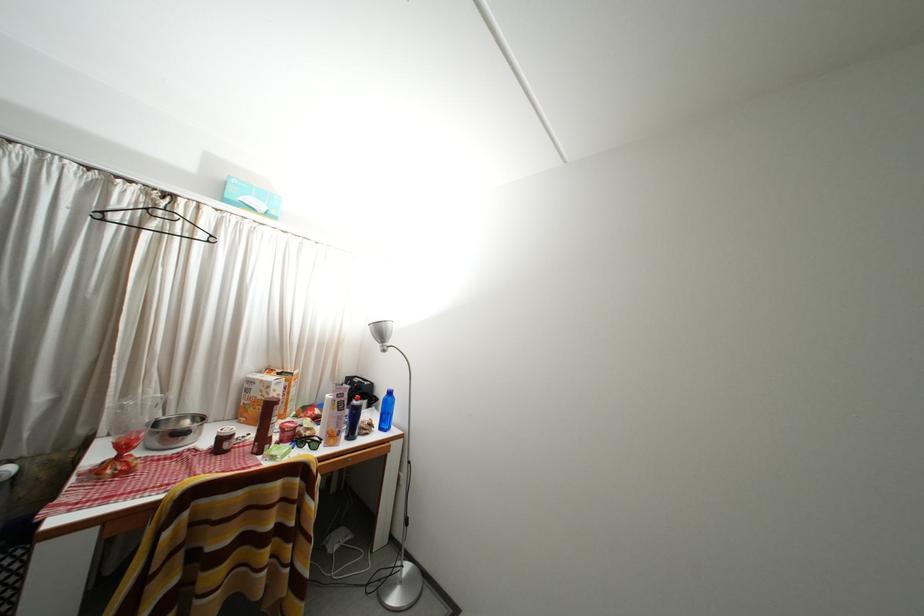
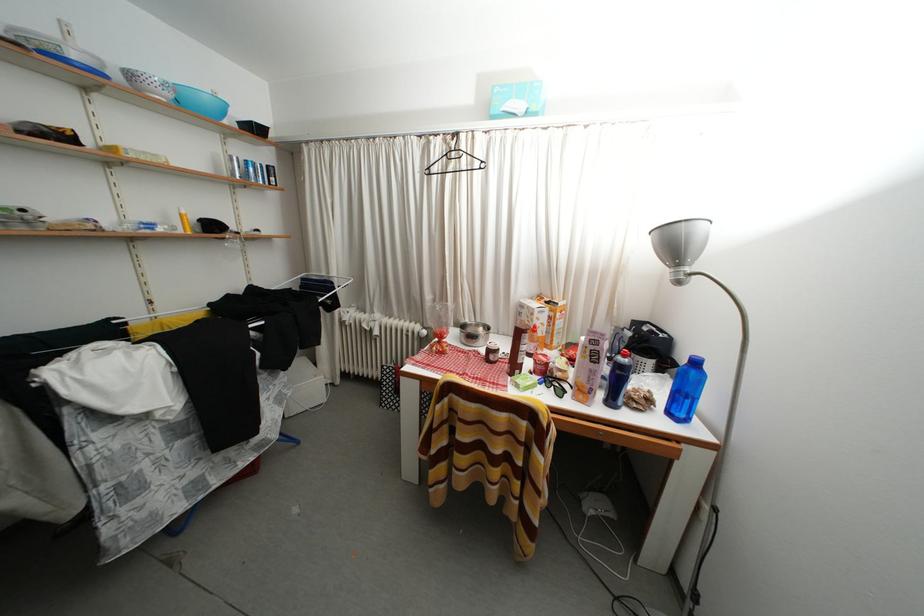
Find the pixel in the second image that matches pixel 229 445 in the first image.

(496, 357)